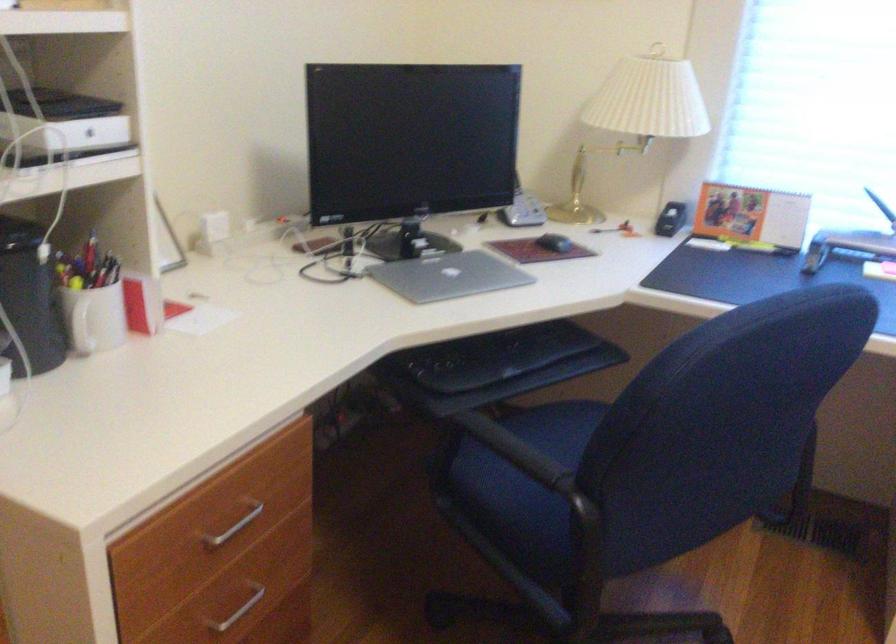
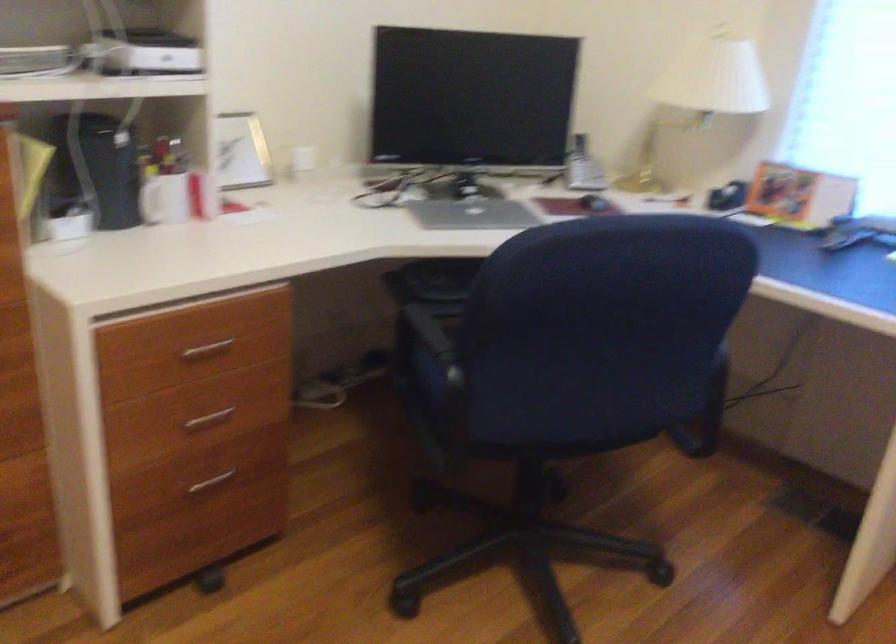
Question: The first image is from the beginning of the video and the second image is from the end. How did the camera likely rotate when shooting the video?

Choices:
 (A) Left
 (B) Right
 (C) Up
 (D) Down

Answer: (A)